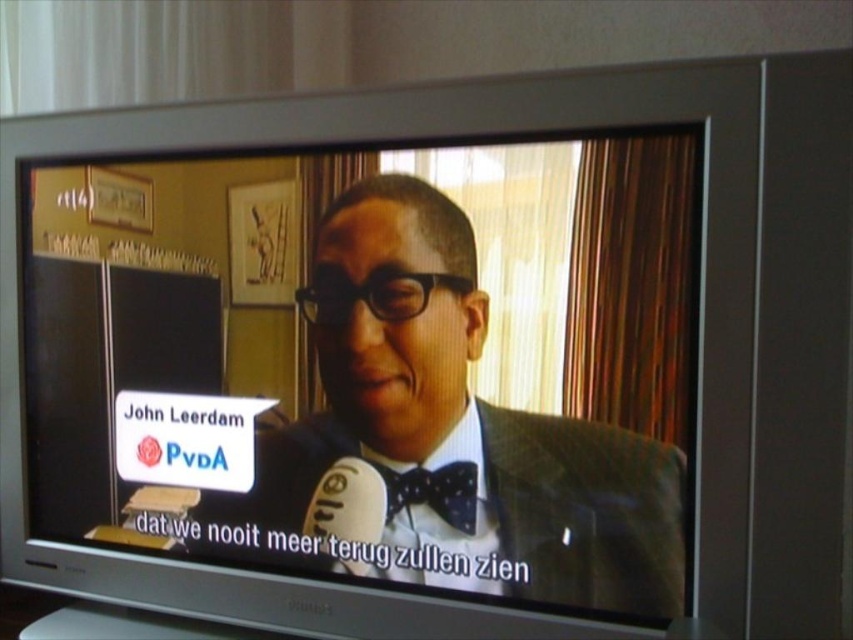
Between polished dark suit at center and black dotted bow tie at center, which one is positioned lower?

Positioned lower is black dotted bow tie at center.

What do you see at coordinates (456, 429) in the screenshot? I see `polished dark suit at center` at bounding box center [456, 429].

Describe the element at coordinates (456, 429) in the screenshot. I see `polished dark suit at center` at that location.

Identify the location of polished dark suit at center. The width and height of the screenshot is (853, 640). (456, 429).